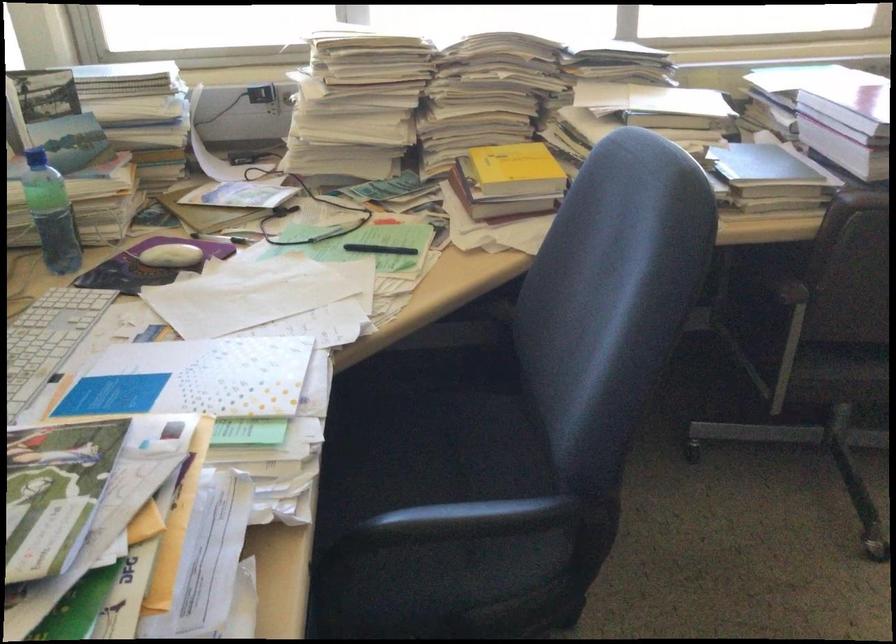
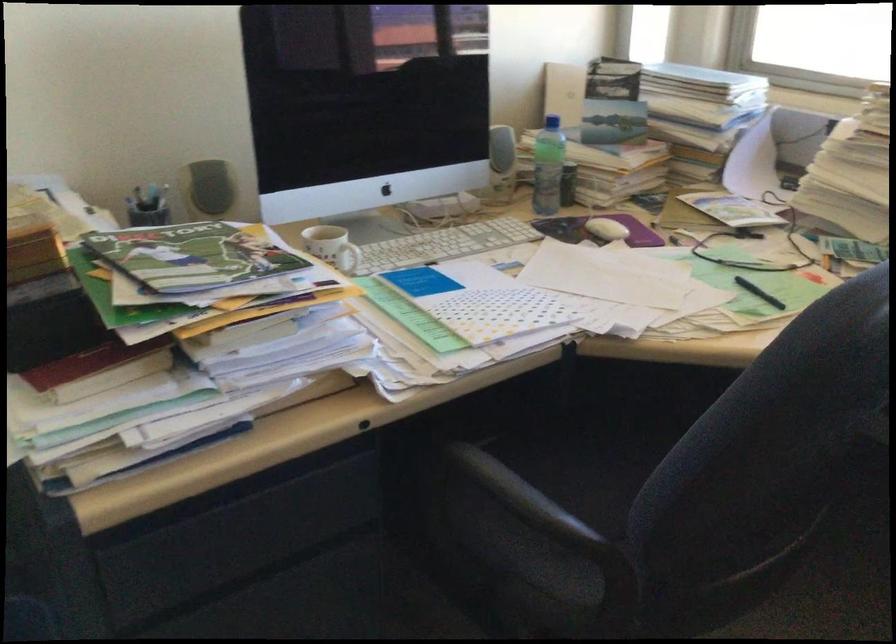
Question: How did the camera likely rotate?

Choices:
 (A) Left
 (B) Right
 (C) Up
 (D) Down

Answer: (A)